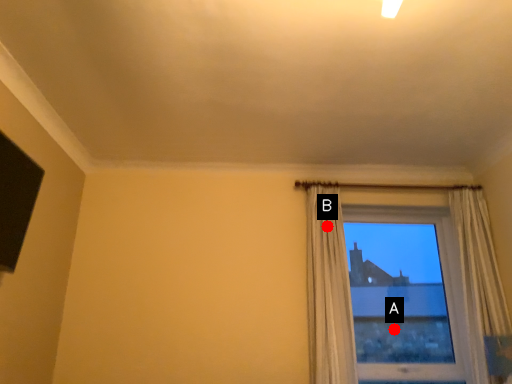
Question: Two points are circled on the image, labeled by A and B beside each circle. Which point is farther to the camera?

Choices:
 (A) A is further
 (B) B is further

Answer: (A)